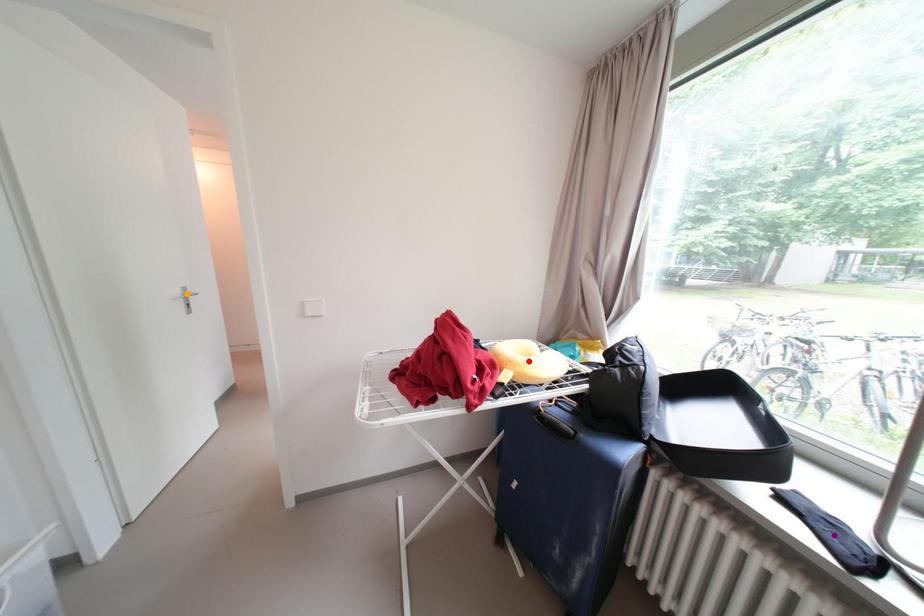
Order these from nearest to farthest:
orange point, purple point, red point

purple point < red point < orange point